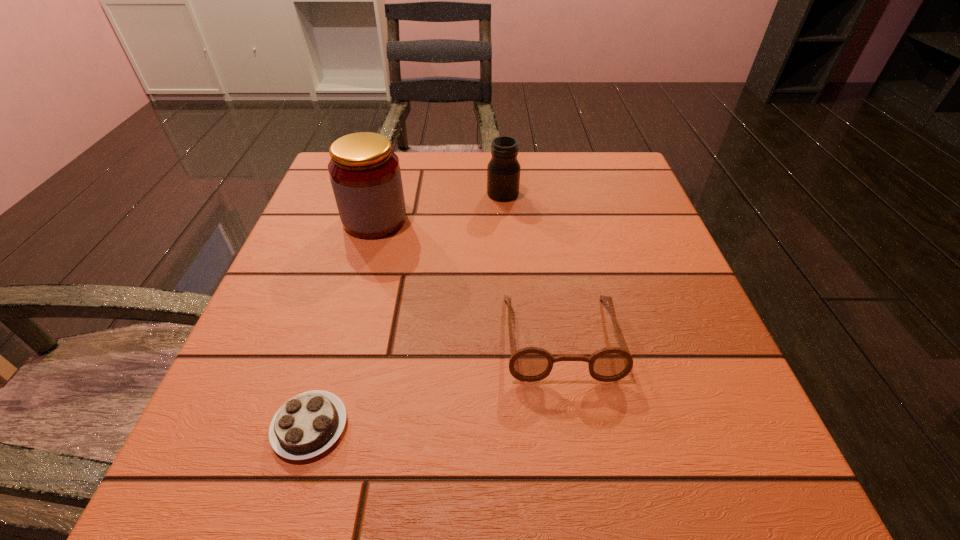
This screenshot has width=960, height=540. What are the coordinates of `vacant space located on the front-facing side of the second nearest object` in the screenshot? It's located at (579, 451).

The width and height of the screenshot is (960, 540). What are the coordinates of `blank space located 0.300m on the back of the chocolate cake` in the screenshot? It's located at (361, 255).

Identify the location of object that is at the near edge. This screenshot has height=540, width=960. coord(308,424).

The image size is (960, 540). What are the coordinates of `jar positioned at the left edge` in the screenshot? It's located at (365, 175).

The width and height of the screenshot is (960, 540). In order to click on chocolate cake located in the left edge section of the desktop in this screenshot , I will do `click(308, 424)`.

Where is `object that is at the right edge`? object that is at the right edge is located at coordinates click(x=530, y=364).

This screenshot has width=960, height=540. What are the coordinates of `object present at the far left corner` in the screenshot? It's located at (365, 175).

This screenshot has width=960, height=540. I want to click on object that is at the near left corner, so click(308, 424).

In the image, there is a desktop. Identify the location of vacant region at the near edge. Image resolution: width=960 pixels, height=540 pixels. (546, 475).

I want to click on free space at the left edge of the desktop, so click(x=357, y=282).